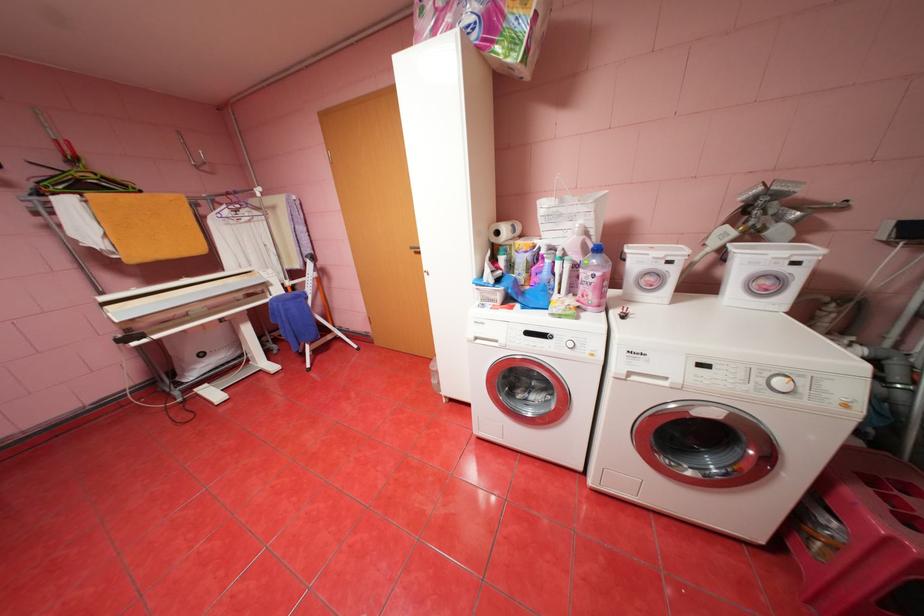
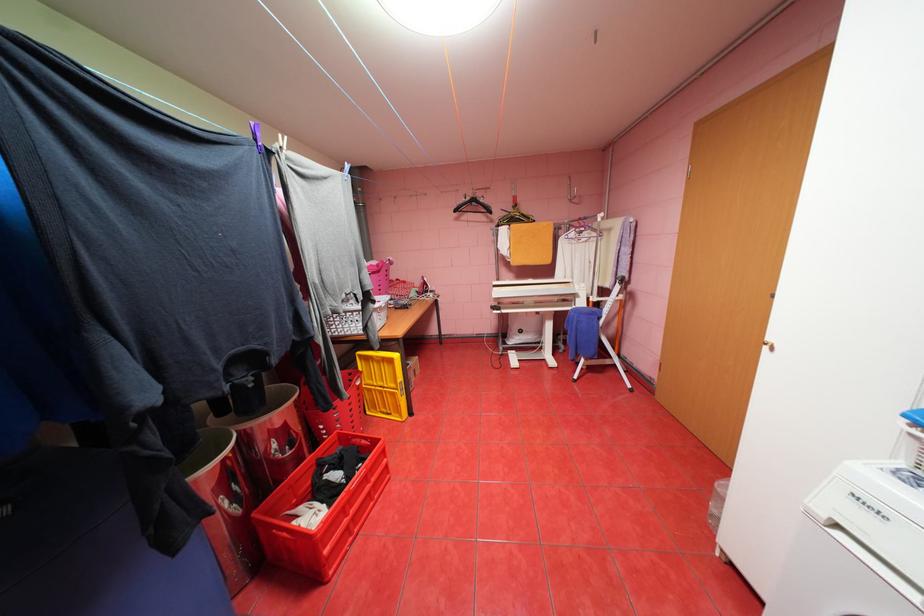
Where in the second image is the point corresponding to point 315,346 from the first image?

(591, 360)